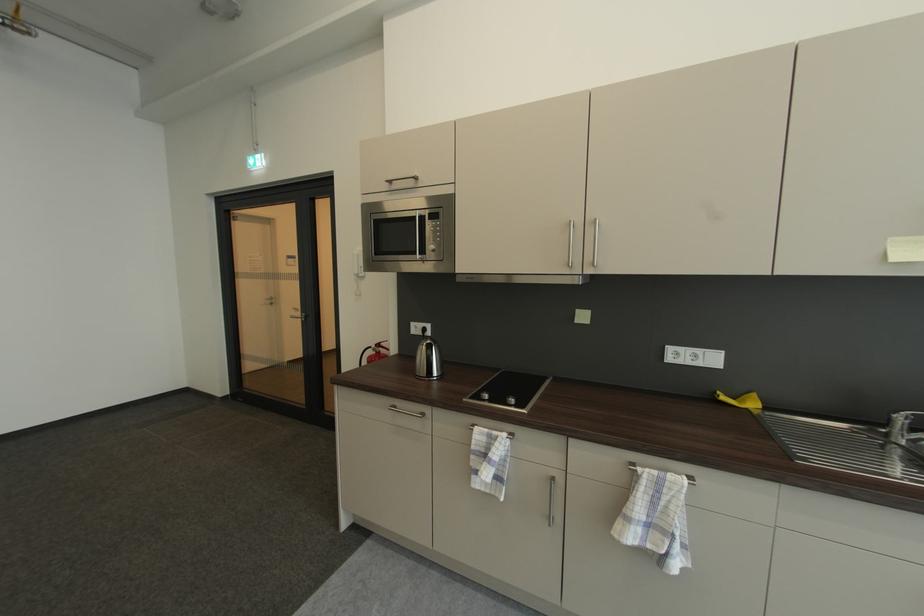
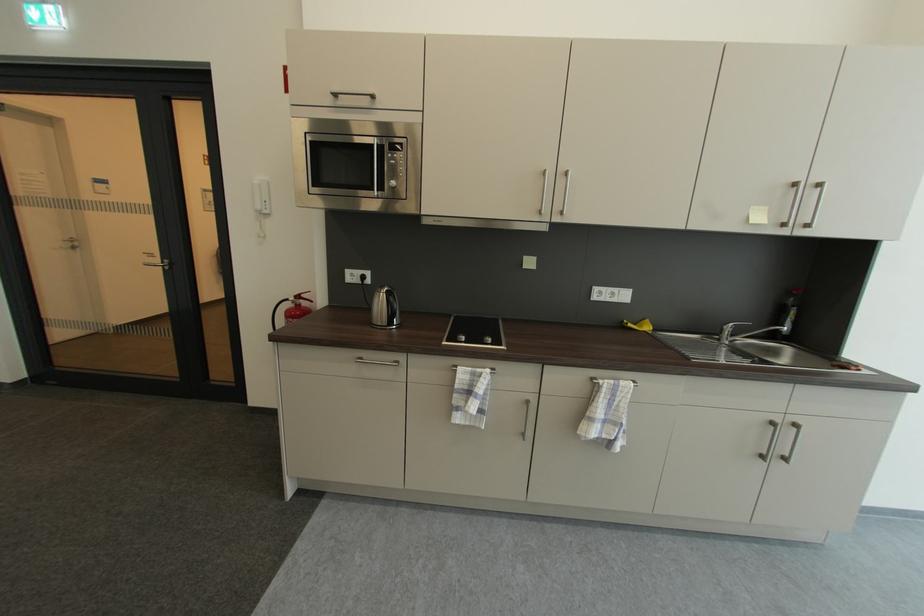
Where in the second image is the point corresponding to (x=435, y=353) from the first image?

(397, 301)